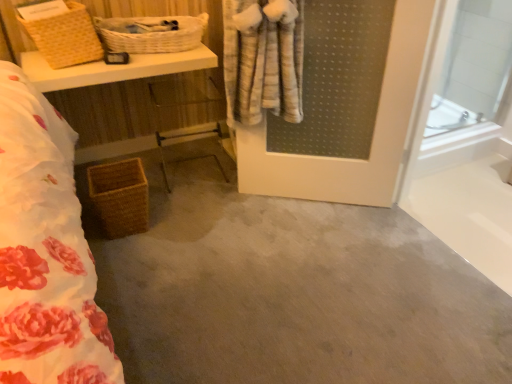
Where is `vacant area located to the right-hand side of woven brown basket at lower left, the third basket in the top-to-bottom sequence`? The height and width of the screenshot is (384, 512). vacant area located to the right-hand side of woven brown basket at lower left, the third basket in the top-to-bottom sequence is located at coordinates (170, 225).